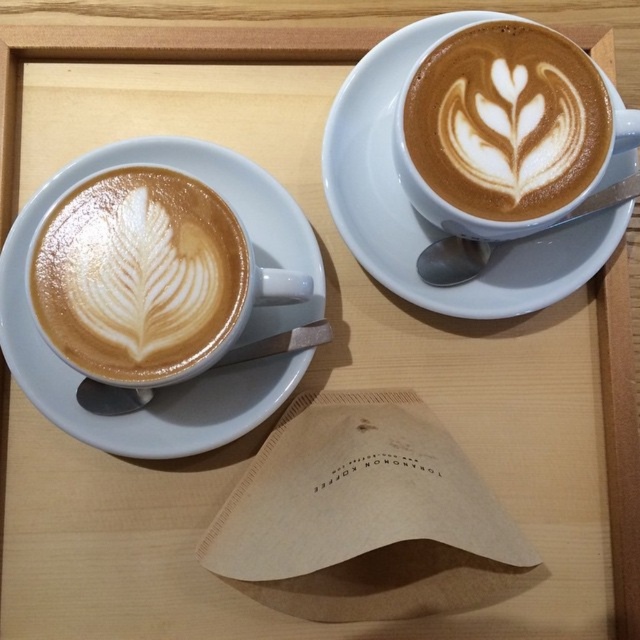
You are a barista arranging items on a tray. You have a matte white cup at left and a white ceramic saucer at lower left. Which item is taller when placed next to each other?

The white ceramic saucer at lower left is taller than the matte white cup at left.